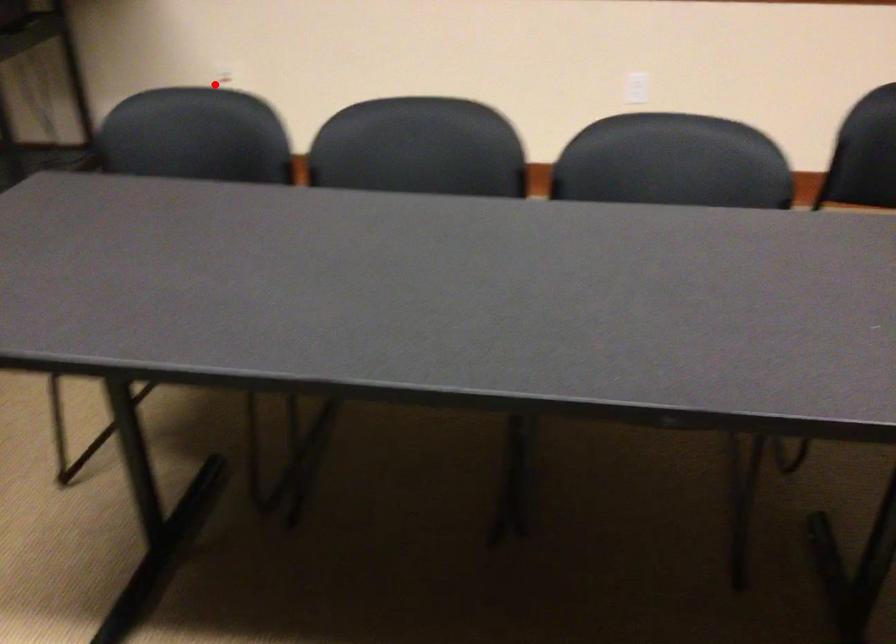
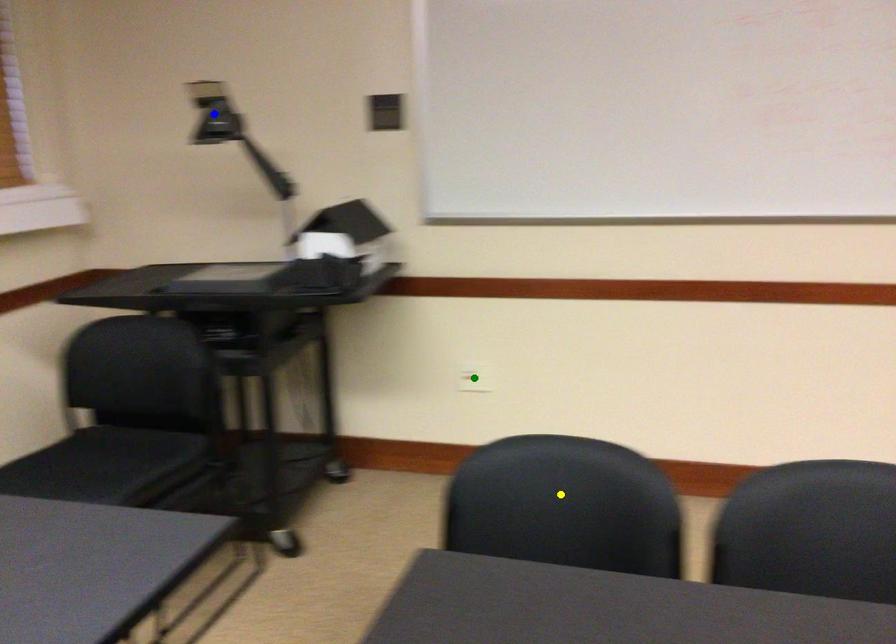
Question: I am providing you with two images of the same scene from different viewpoints. A red point is marked on the first image. You are given multiple points on the second image. Which point in image 2 represents the same 3d spot as the red point in image 1?

Choices:
 (A) yellow point
 (B) green point
 (C) blue point

Answer: (B)